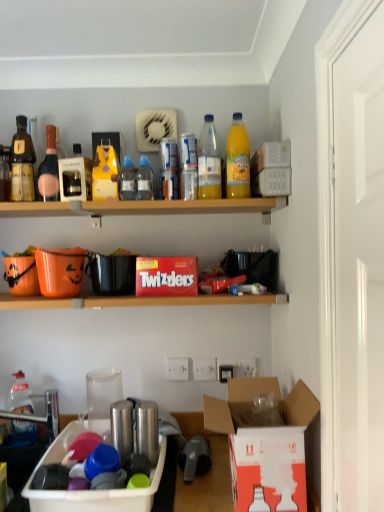
Question: Is orange matte plastic bucket at left facing away from transparent plastic bottle at center, the second bottle from the top?

Choices:
 (A) no
 (B) yes

Answer: (A)

Question: Are orange matte plastic bucket at left and transparent plastic bottle at center, which appears as the 6th bottle when viewed from the left, making contact?

Choices:
 (A) no
 (B) yes

Answer: (A)

Question: Is the position of orange matte plastic bucket at left more distant than that of transparent plastic bottle at center, which is the first bottle in right-to-left order?

Choices:
 (A) yes
 (B) no

Answer: (A)

Question: Is orange matte plastic bucket at left outside transparent plastic bottle at center, which appears as the 6th bottle when viewed from the left?

Choices:
 (A) no
 (B) yes

Answer: (B)

Question: Does orange matte plastic bucket at left have a smaller size compared to transparent plastic bottle at center, which is the first bottle in right-to-left order?

Choices:
 (A) no
 (B) yes

Answer: (A)

Question: Is orange matte plastic bucket at left to the right of transparent plastic bottle at center, the fifth bottle in the bottom-to-top sequence, from the viewer's perspective?

Choices:
 (A) yes
 (B) no

Answer: (B)

Question: From a real-world perspective, is transparent plastic bottle at upper center, which ranks as the fifth bottle in top-to-bottom order, beneath white cardboard box at lower right, which appears as the 3th box when viewed from the left?

Choices:
 (A) yes
 (B) no

Answer: (B)

Question: From a real-world perspective, is transparent plastic bottle at upper center, which ranks as the fifth bottle in top-to-bottom order, physically above white cardboard box at lower right, marked as the 2th box in a top-to-bottom arrangement?

Choices:
 (A) yes
 (B) no

Answer: (A)

Question: Does transparent plastic bottle at upper center, which is counted as the 2th bottle, starting from the bottom, have a lesser height compared to white cardboard box at lower right, marked as the 2th box in a top-to-bottom arrangement?

Choices:
 (A) yes
 (B) no

Answer: (A)

Question: Does transparent plastic bottle at upper center, arranged as the 5th bottle when viewed from the left, have a lesser width compared to white cardboard box at lower right, which is counted as the 2th box, starting from the bottom?

Choices:
 (A) yes
 (B) no

Answer: (A)

Question: Is transparent plastic bottle at upper center, arranged as the second bottle when viewed from the right, at the right side of white cardboard box at lower right, which is counted as the first box, starting from the right?

Choices:
 (A) yes
 (B) no

Answer: (B)

Question: Does transparent plastic bottle at upper center, which ranks as the fifth bottle in top-to-bottom order, touch white cardboard box at lower right, which is counted as the first box, starting from the right?

Choices:
 (A) no
 (B) yes

Answer: (A)

Question: Can you confirm if transparent plastic bottle at upper center, which ranks as the fifth bottle in top-to-bottom order, is shorter than translucent plastic bottle at upper center, acting as the third bottle starting from the bottom?

Choices:
 (A) no
 (B) yes

Answer: (A)